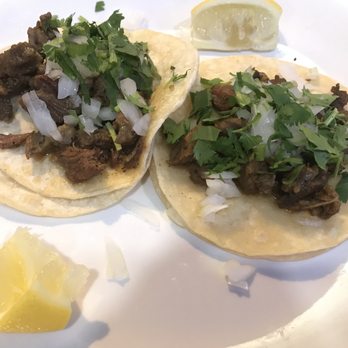
This screenshot has height=348, width=348. What are the coordinates of `plate` in the screenshot? It's located at (153, 273).